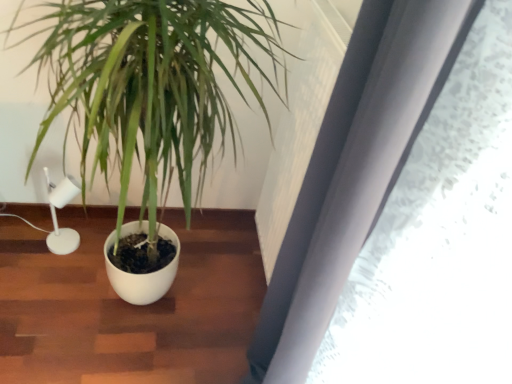
Identify the location of vacant area to the right of white matte lamp at left. (95, 254).